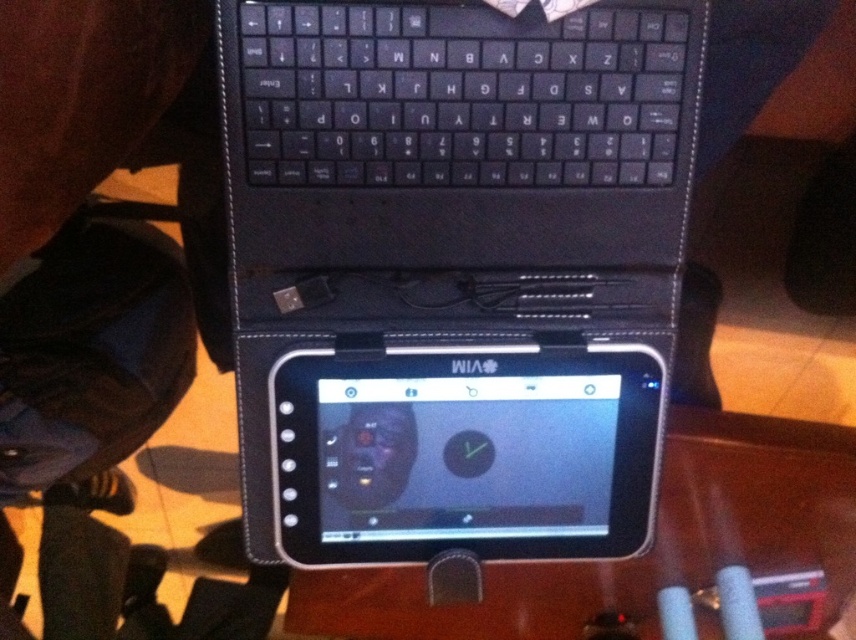
Does point (274, 145) lie in front of point (397, 124)?

That is True.

Can you confirm if black matte tablet at center is positioned to the left of black plastic keyboard at upper center?

Indeed, black matte tablet at center is positioned on the left side of black plastic keyboard at upper center.

Identify the location of black matte tablet at center. (455, 266).

Image resolution: width=856 pixels, height=640 pixels. Find the location of `black matte tablet at center`. black matte tablet at center is located at coordinates (455, 266).

Can you confirm if black matte tablet at center is positioned to the left of black glossy tablet at center?

Correct, you'll find black matte tablet at center to the left of black glossy tablet at center.

Is black matte tablet at center thinner than black glossy tablet at center?

No, black matte tablet at center is not thinner than black glossy tablet at center.

The width and height of the screenshot is (856, 640). What do you see at coordinates (455, 266) in the screenshot?
I see `black matte tablet at center` at bounding box center [455, 266].

This screenshot has width=856, height=640. Identify the location of black matte tablet at center. click(455, 266).

Who is taller, black glossy tablet at center or black plastic keyboard at upper center?

With more height is black glossy tablet at center.

Does point (474, 518) come farther from viewer compared to point (553, 132)?

Yes, point (474, 518) is farther from viewer.

Which is in front, point (497, 451) or point (270, 45)?

Point (270, 45) is in front.

Where is `black glossy tablet at center`? black glossy tablet at center is located at coordinates (465, 452).